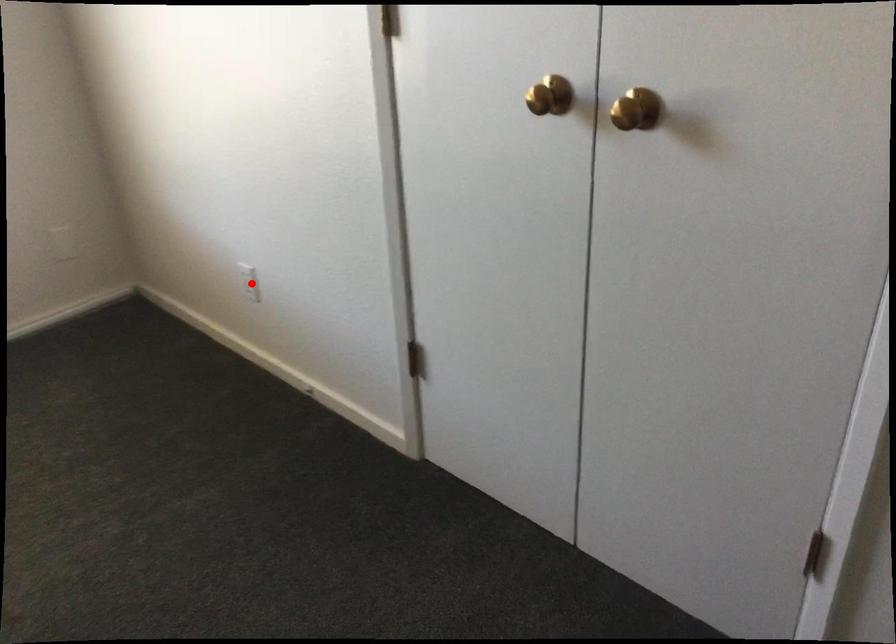
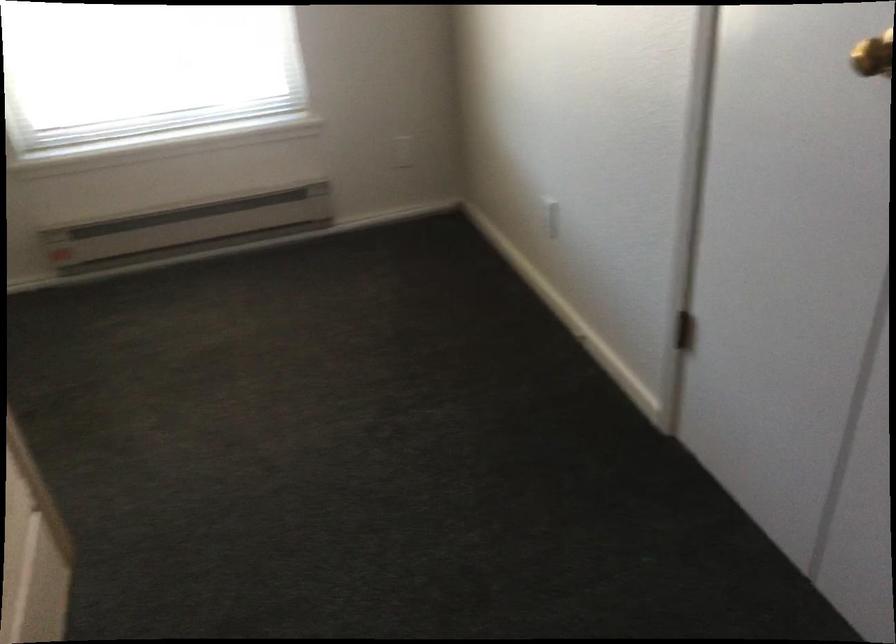
The point at the highlighted location is marked in the first image. Where is the corresponding point in the second image?

(550, 216)